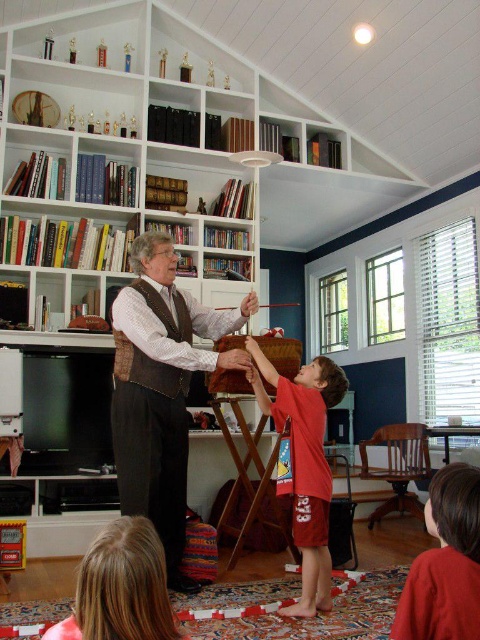
Is white wood bookcase at upper center positioned behind brown leather vest at center?

Yes, it is.

Does white wood bookcase at upper center have a greater width compared to brown leather vest at center?

Yes, white wood bookcase at upper center is wider than brown leather vest at center.

The height and width of the screenshot is (640, 480). Describe the element at coordinates (121, 156) in the screenshot. I see `white wood bookcase at upper center` at that location.

Find the location of a particular element. The width and height of the screenshot is (480, 640). white wood bookcase at upper center is located at coordinates (121, 156).

Who is shorter, white wood bookcase at upper center or red cotton shorts at lower center?

red cotton shorts at lower center

Can you confirm if white wood bookcase at upper center is wider than red cotton shorts at lower center?

Yes.

Who is more distant from viewer, (60, 147) or (313, 486)?

Positioned behind is point (60, 147).

Where is `white wood bookcase at upper center`? The image size is (480, 640). white wood bookcase at upper center is located at coordinates pyautogui.click(x=121, y=156).

The height and width of the screenshot is (640, 480). I want to click on white wood bookcase at upper center, so click(x=121, y=156).

Does point (220, 260) lie in front of point (474, 492)?

No, (220, 260) is behind (474, 492).

Is point (47, 198) closer to camera compared to point (466, 536)?

No.

Find the location of a particular element. Image resolution: width=480 pixels, height=640 pixels. white wood bookcase at upper center is located at coordinates (121, 156).